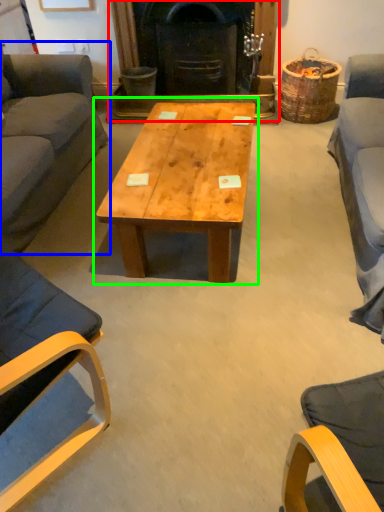
Question: Which object is positioned farthest from fireplace (highlighted by a red box)? Select from studio couch (highlighted by a blue box) and coffee table (highlighted by a green box).

Choices:
 (A) studio couch
 (B) coffee table

Answer: (B)